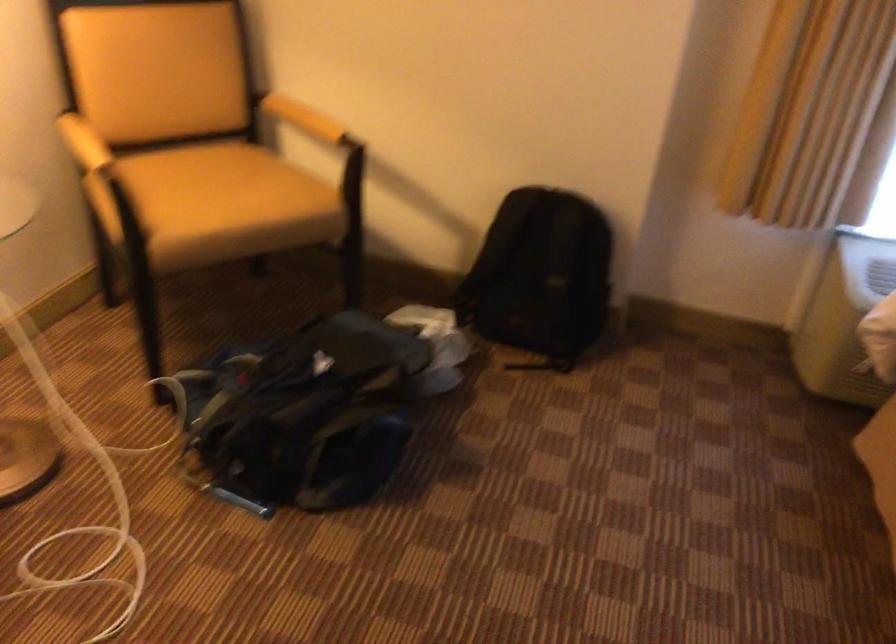
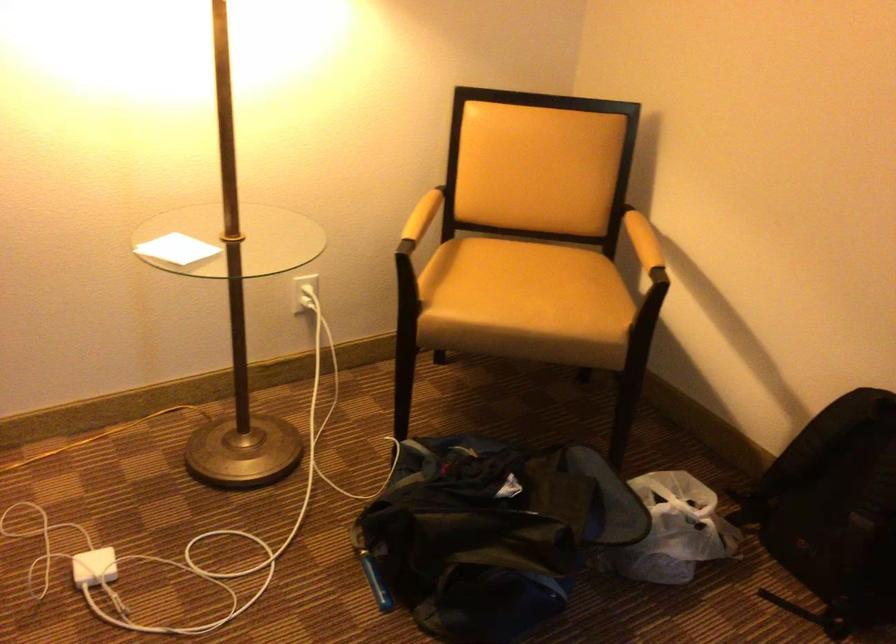
Question: The images are taken continuously from a first-person perspective. In which direction is your viewpoint rotating?

Choices:
 (A) Left
 (B) Right
 (C) Up
 (D) Down

Answer: (A)